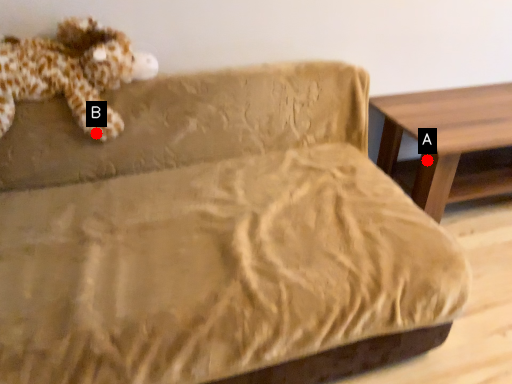
Question: Two points are circled on the image, labeled by A and B beside each circle. Which point appears farthest from the camera in this image?

Choices:
 (A) A is further
 (B) B is further

Answer: (A)